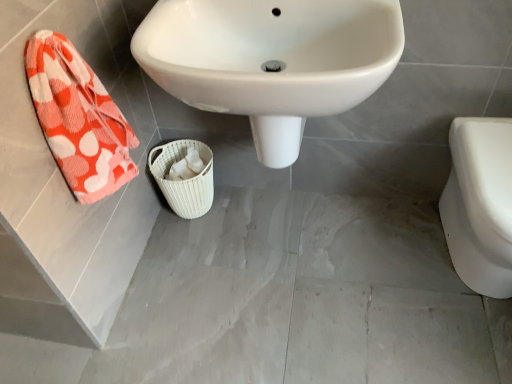
This screenshot has height=384, width=512. I want to click on free space to the left of white glossy toilet at right, so click(x=373, y=271).